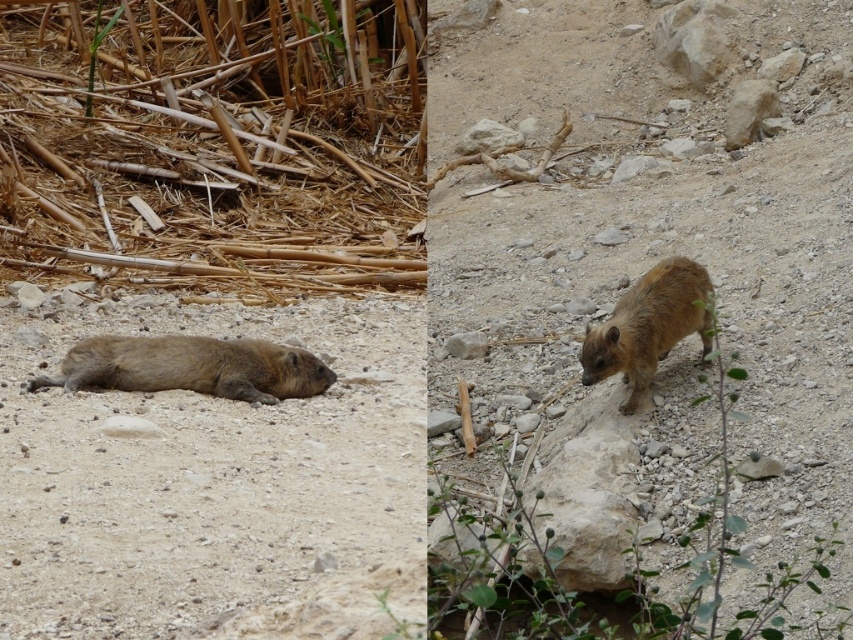
In the scene shown: Does brown furry hyrax at lower left have a larger size compared to brown furry hyrax at center?

Actually, brown furry hyrax at lower left might be smaller than brown furry hyrax at center.

Measure the distance between brown furry hyrax at lower left and camera.

A distance of 5.68 meters exists between brown furry hyrax at lower left and camera.

What do you see at coordinates (190, 368) in the screenshot? The height and width of the screenshot is (640, 853). I see `brown furry hyrax at lower left` at bounding box center [190, 368].

Find the location of a particular element. brown furry hyrax at lower left is located at coordinates (190, 368).